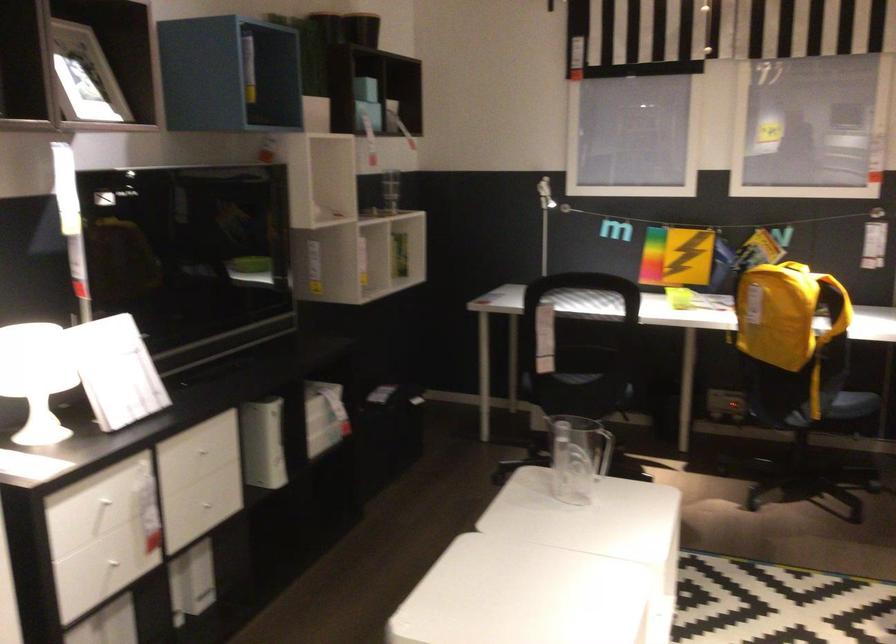
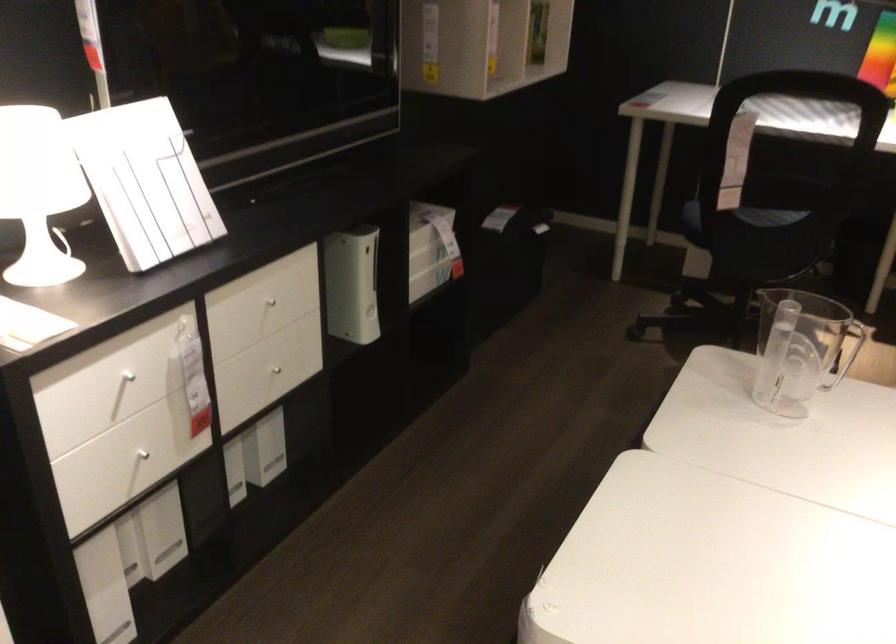
Locate, in the second image, the point that corresponds to point (113, 567) in the first image.

(142, 456)